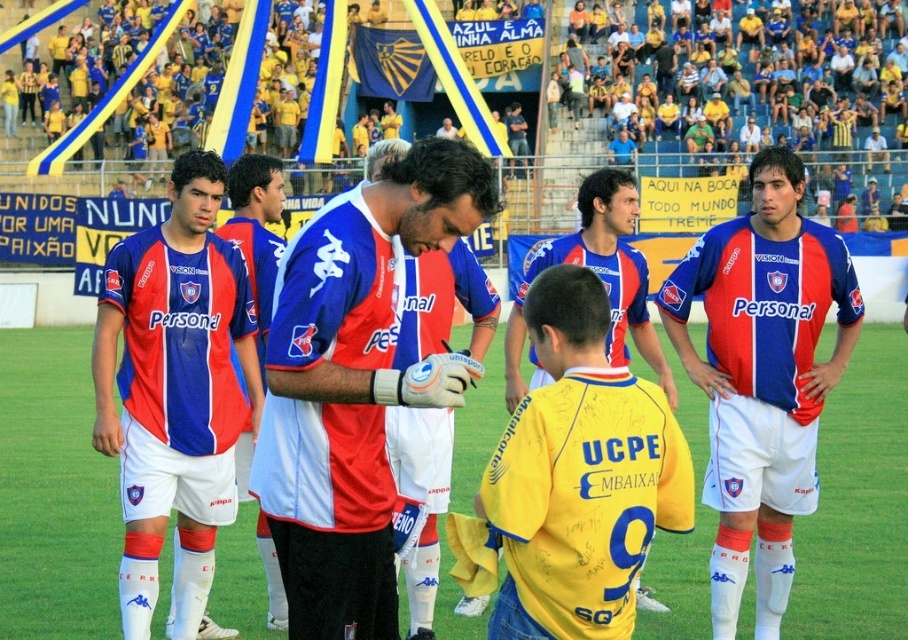
You are a photographer at the soccer match and need to capture both the matte blue jersey at right and the yellow jersey at center in a single shot. Since you want to emphasize the height difference between them, which jersey should you position closer to the camera?

The matte blue jersey at right is taller than the yellow jersey at center, so to emphasize the height difference, position the yellow jersey at center closer to the camera.

You are a photographer at the soccer match and want to capture a photo of the matte blue and red jersey at center. The stadium has a rule that you must stay within a 10 meter radius from your assigned position at point 0.562, 0.372. Can you confirm if you are within the allowed area to take the photo?

The matte blue and red jersey at center is located at point (337, 358). Since your assigned position is also at point (337, 358), you are exactly at the center point, so you are within the 10 meter radius allowed area to take the photo.